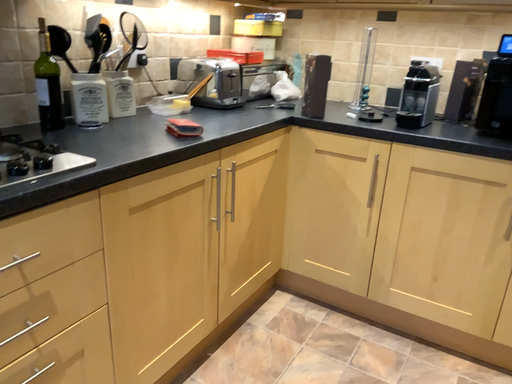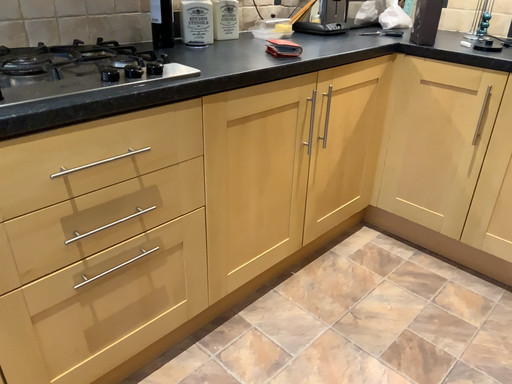
Question: How did the camera likely rotate when shooting the video?

Choices:
 (A) rotated left
 (B) rotated right

Answer: (A)